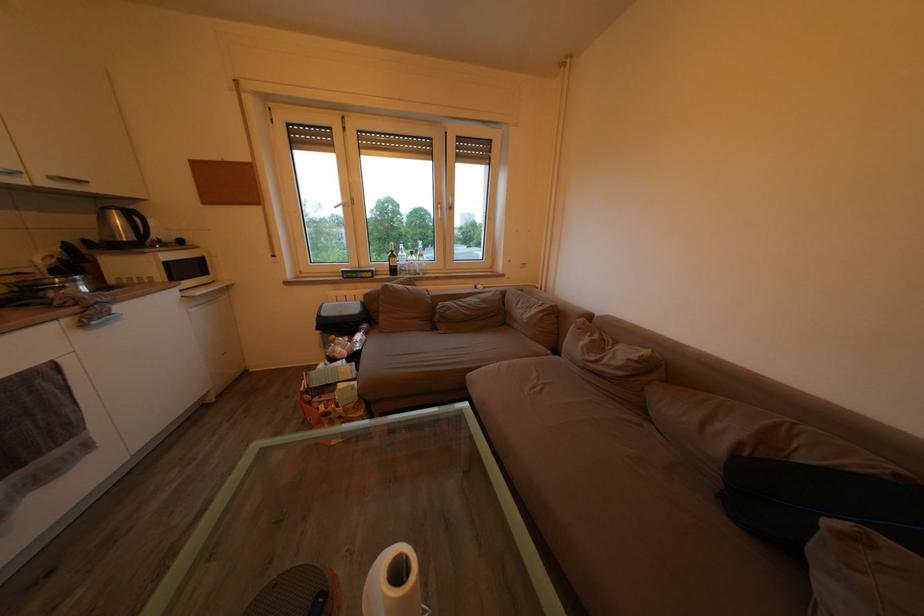
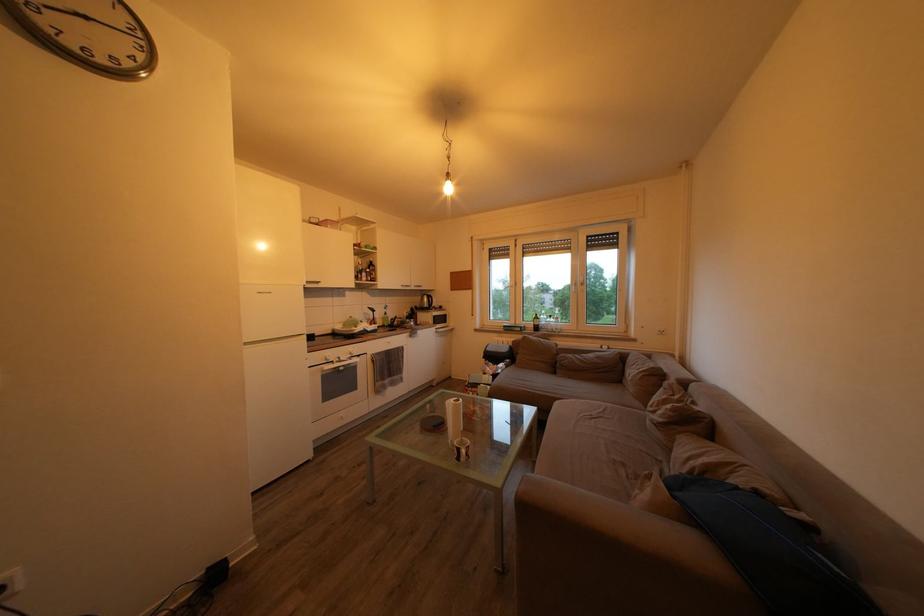
In the second image, find the point that corresponds to the point at 599,365 in the first image.

(659, 416)